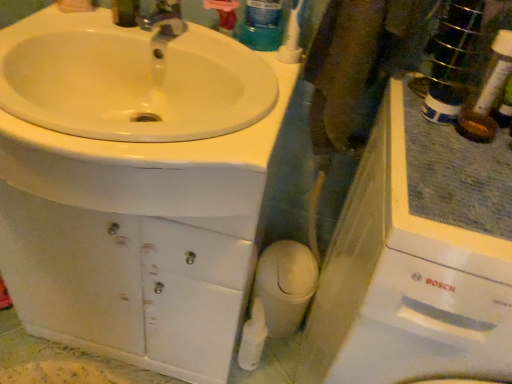
Locate an element on the screen. This screenshot has height=384, width=512. free space in front of white plastic toothbrush at upper right is located at coordinates (273, 81).